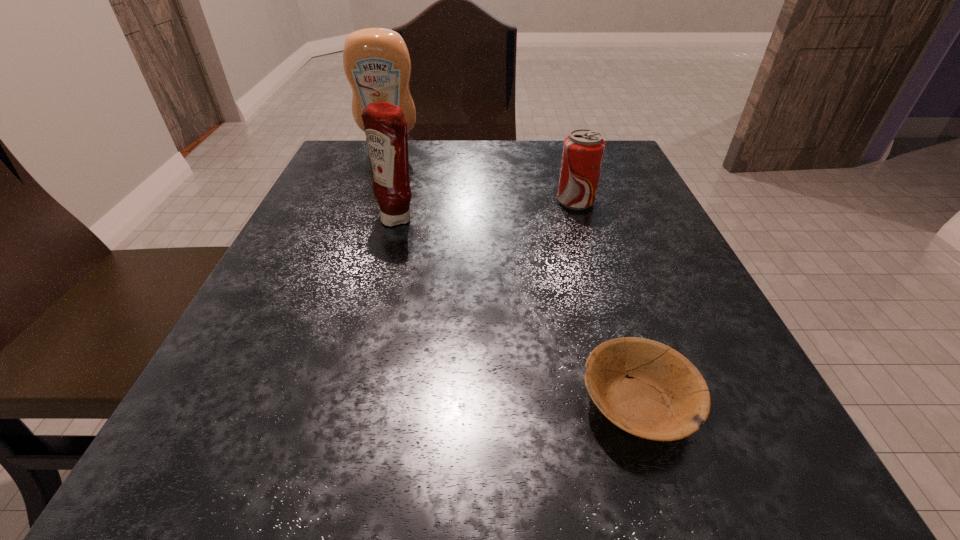
The height and width of the screenshot is (540, 960). I want to click on vacant space located on the left of the bowl, so pos(467,403).

This screenshot has height=540, width=960. Find the location of `object located in the far edge section of the desktop`. object located in the far edge section of the desktop is located at coordinates (376, 61).

Locate an element on the screen. The image size is (960, 540). object that is at the near edge is located at coordinates coord(664,397).

The height and width of the screenshot is (540, 960). I want to click on soda can present at the right edge, so click(x=583, y=151).

Identify the location of bowl present at the right edge. The height and width of the screenshot is (540, 960). (664, 397).

At what (x,y) coordinates should I click in order to perform the action: click on object present at the far left corner. Please return your answer as a coordinate pair (x, y). The height and width of the screenshot is (540, 960). Looking at the image, I should click on (376, 61).

Find the location of `object located in the near right corner section of the desktop`. object located in the near right corner section of the desktop is located at coordinates (664, 397).

Where is `blank area at the far edge`? Image resolution: width=960 pixels, height=540 pixels. blank area at the far edge is located at coordinates (474, 142).

At what (x,y) coordinates should I click in order to perform the action: click on vacant point at the near edge. Please return your answer as a coordinate pair (x, y). Looking at the image, I should click on (542, 449).

This screenshot has width=960, height=540. Identify the location of free space at the left edge of the desktop. (359, 279).